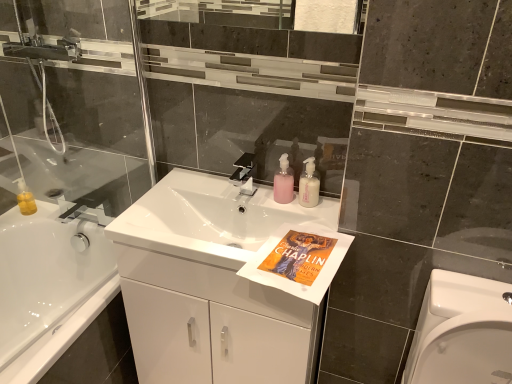
Question: Can you confirm if white glossy bathtub at left is bigger than pink translucent pump bottle at center, the 2th toiletry in the right-to-left sequence?

Choices:
 (A) yes
 (B) no

Answer: (A)

Question: From the image's perspective, would you say white glossy bathtub at left is shown under pink translucent pump bottle at center, the 2th toiletry in the right-to-left sequence?

Choices:
 (A) yes
 (B) no

Answer: (A)

Question: Is white glossy bathtub at left smaller than pink translucent pump bottle at center, the 2th toiletry in the right-to-left sequence?

Choices:
 (A) no
 (B) yes

Answer: (A)

Question: Is white glossy bathtub at left surrounding pink translucent pump bottle at center, which is counted as the first toiletry, starting from the left?

Choices:
 (A) yes
 (B) no

Answer: (B)

Question: Does white glossy bathtub at left appear on the right side of pink translucent pump bottle at center, which is counted as the first toiletry, starting from the left?

Choices:
 (A) no
 (B) yes

Answer: (A)

Question: Is white glossy bathtub at left looking in the opposite direction of pink translucent pump bottle at center, which is counted as the first toiletry, starting from the left?

Choices:
 (A) no
 (B) yes

Answer: (A)

Question: Considering the relative sizes of white glossy bathtub at left and white glossy cabinet at center in the image provided, is white glossy bathtub at left taller than white glossy cabinet at center?

Choices:
 (A) no
 (B) yes

Answer: (A)

Question: From the image's perspective, does white glossy bathtub at left appear lower than white glossy cabinet at center?

Choices:
 (A) yes
 (B) no

Answer: (A)

Question: Does white glossy bathtub at left turn towards white glossy cabinet at center?

Choices:
 (A) no
 (B) yes

Answer: (B)

Question: From the image's perspective, is white glossy bathtub at left on white glossy cabinet at center?

Choices:
 (A) yes
 (B) no

Answer: (B)

Question: Is white glossy cabinet at center at the back of white glossy bathtub at left?

Choices:
 (A) no
 (B) yes

Answer: (A)

Question: Can you confirm if white glossy bathtub at left is positioned to the left of white glossy cabinet at center?

Choices:
 (A) no
 (B) yes

Answer: (B)

Question: Is transparent glass shower door at left aimed at pink matte soap dispenser at center, marked as the 2th toiletry in a left-to-right arrangement?

Choices:
 (A) no
 (B) yes

Answer: (A)